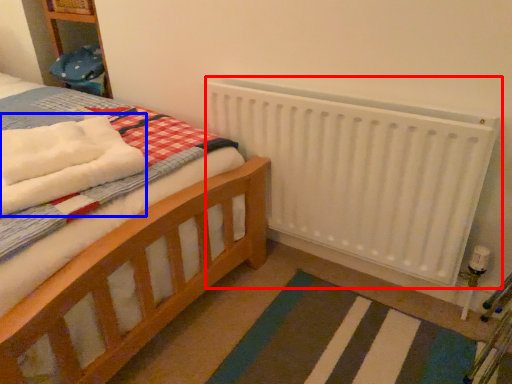
Question: Which object appears farthest to the camera in this image, radiator (highlighted by a red box) or bath towel (highlighted by a blue box)?

Choices:
 (A) radiator
 (B) bath towel

Answer: (A)